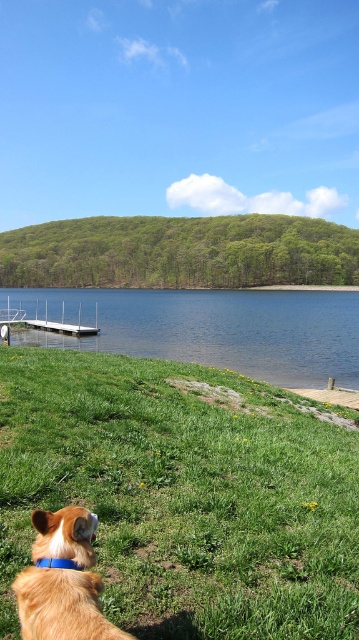
You are a photographer planning to capture the entire scene in one shot. Given that the green grassy at lower center and the white metallic dock at lower left are both in the frame, which one takes up more space in the photo?

The white metallic dock at lower left takes up more space in the photo because the green grassy at lower center is smaller than the white metallic dock at lower left according to the description.

Based on the photo, you are standing at the center of the image and want to walk towards the golden fur dog at lower left. Which direction should you move to reach it?

The golden fur dog at lower left is located at point (62, 580), so you should move towards the lower left direction to reach it.

You are a photographer standing at the edge of the lake and want to capture both the blue water at lower center and the golden fur dog at lower left in the same frame. Given that your camera has a 50mm lens, which has a field of view of approximately 46 degrees, can you fit both subjects into the frame without moving your position? Please explain your reasoning.

The blue water at lower center and the golden fur dog at lower left are 202.02 feet apart. With a 50mm lens providing a 46 degree field of view, it is unlikely that both subjects can be captured in the same frame from your current position, as the distance between them exceeds the lens coverage.